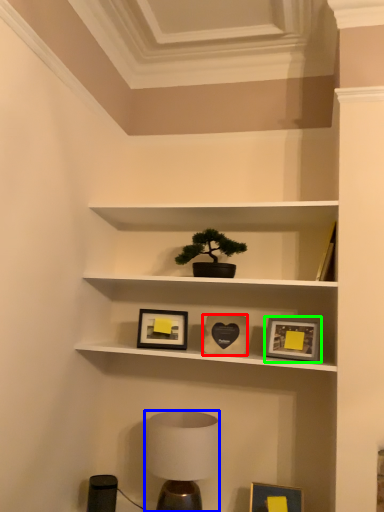
Question: Which object is positioned closest to picture frame (highlighted by a red box)? Select from table lamp (highlighted by a blue box) and picture frame (highlighted by a green box).

Choices:
 (A) table lamp
 (B) picture frame

Answer: (B)